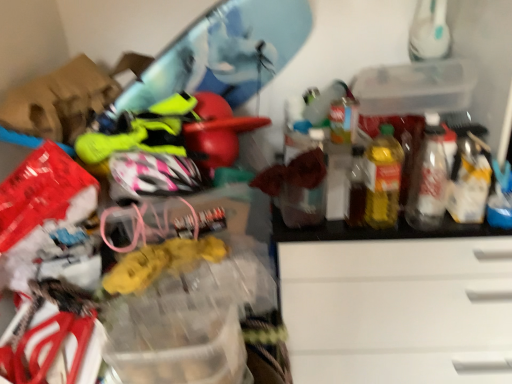
The height and width of the screenshot is (384, 512). What do you see at coordinates (383, 179) in the screenshot?
I see `yellow translucent bottle at right, which ranks as the 1th bottle in left-to-right order` at bounding box center [383, 179].

Looking at this image, what is the approximate width of yellow translucent bottle at right, which is the second bottle from right to left?

yellow translucent bottle at right, which is the second bottle from right to left, is 4.96 inches wide.

Where is `translucent plastic bottle at right, which is counted as the 1th bottle, starting from the right`? Image resolution: width=512 pixels, height=384 pixels. translucent plastic bottle at right, which is counted as the 1th bottle, starting from the right is located at coordinates (428, 182).

In order to face transparent plastic storage box at upper right, should I rotate leftwards or rightwards?

To face it directly, rotate right by 18.977 degrees.

Measure the distance between point (434, 84) and camera.

Point (434, 84) and camera are 4.58 feet apart.

The width and height of the screenshot is (512, 384). In order to click on yellow translucent bottle at right, which is the second bottle from right to left in this screenshot , I will do `click(383, 179)`.

From the image's perspective, who appears lower, transparent plastic storage box at upper right or yellow translucent bottle at right, which is the second bottle from right to left?

yellow translucent bottle at right, which is the second bottle from right to left, is shown below in the image.

How different are the orientations of transparent plastic storage box at upper right and yellow translucent bottle at right, which ranks as the 1th bottle in left-to-right order, in degrees?

2.23 degrees.

Considering the positions of objects transparent plastic storage box at upper right and yellow translucent bottle at right, which ranks as the 1th bottle in left-to-right order, in the image provided, who is more to the right, transparent plastic storage box at upper right or yellow translucent bottle at right, which ranks as the 1th bottle in left-to-right order,?

transparent plastic storage box at upper right is more to the right.

Is the depth of transparent plastic storage box at upper right less than that of yellow translucent bottle at right, which is the second bottle from right to left?

No.

Considering the relative sizes of yellow translucent bottle at right, which is the second bottle from right to left, and transparent plastic storage box at upper right in the image provided, is yellow translucent bottle at right, which is the second bottle from right to left, taller than transparent plastic storage box at upper right?

Yes, yellow translucent bottle at right, which is the second bottle from right to left, is taller than transparent plastic storage box at upper right.

Is yellow translucent bottle at right, which ranks as the 1th bottle in left-to-right order, further to camera compared to transparent plastic storage box at upper right?

No.

Does yellow translucent bottle at right, which is the second bottle from right to left, appear on the right side of transparent plastic storage box at upper right?

In fact, yellow translucent bottle at right, which is the second bottle from right to left, is to the left of transparent plastic storage box at upper right.

From a real-world perspective, is yellow translucent bottle at right, which ranks as the 1th bottle in left-to-right order, under transparent plastic storage box at upper right?

Indeed, from a real-world perspective, yellow translucent bottle at right, which ranks as the 1th bottle in left-to-right order, is positioned beneath transparent plastic storage box at upper right.

Who is more distant, translucent plastic bottle at right, which is counted as the 1th bottle, starting from the right, or yellow translucent bottle at right, which ranks as the 1th bottle in left-to-right order?

translucent plastic bottle at right, which is counted as the 1th bottle, starting from the right.

From the picture: Is translucent plastic bottle at right, positioned as the second bottle in left-to-right order, not near yellow translucent bottle at right, which ranks as the 1th bottle in left-to-right order?

No, translucent plastic bottle at right, positioned as the second bottle in left-to-right order, is not far from yellow translucent bottle at right, which ranks as the 1th bottle in left-to-right order.

Which is more to the left, translucent plastic bottle at right, positioned as the second bottle in left-to-right order, or yellow translucent bottle at right, which is the second bottle from right to left?

yellow translucent bottle at right, which is the second bottle from right to left.

The width and height of the screenshot is (512, 384). I want to click on bottle that is on the left side of translucent plastic bottle at right, positioned as the second bottle in left-to-right order, so click(x=383, y=179).

How different are the orientations of yellow translucent bottle at right, which is the second bottle from right to left, and translucent plastic bottle at right, which is counted as the 1th bottle, starting from the right, in degrees?

There is a 3.78-degree angle between the facing directions of yellow translucent bottle at right, which is the second bottle from right to left, and translucent plastic bottle at right, which is counted as the 1th bottle, starting from the right.

Who is more distant, yellow translucent bottle at right, which is the second bottle from right to left, or translucent plastic bottle at right, which is counted as the 1th bottle, starting from the right?

translucent plastic bottle at right, which is counted as the 1th bottle, starting from the right, is further from the camera.

In the scene shown: Is transparent plastic storage box at upper right taller than translucent plastic bottle at right, which is counted as the 1th bottle, starting from the right?

In fact, transparent plastic storage box at upper right may be shorter than translucent plastic bottle at right, which is counted as the 1th bottle, starting from the right.

Between transparent plastic storage box at upper right and translucent plastic bottle at right, which is counted as the 1th bottle, starting from the right, which one appears on the left side from the viewer's perspective?

From the viewer's perspective, transparent plastic storage box at upper right appears more on the left side.

Is transparent plastic storage box at upper right bigger or smaller than translucent plastic bottle at right, positioned as the second bottle in left-to-right order?

In the image, transparent plastic storage box at upper right appears to be larger than translucent plastic bottle at right, positioned as the second bottle in left-to-right order.

From the image's perspective, is transparent plastic storage box at upper right located above or below translucent plastic bottle at right, positioned as the second bottle in left-to-right order?

transparent plastic storage box at upper right is situated higher than translucent plastic bottle at right, positioned as the second bottle in left-to-right order, in the image.

From a real-world perspective, which is physically below, translucent plastic bottle at right, which is counted as the 1th bottle, starting from the right, or transparent plastic storage box at upper right?

translucent plastic bottle at right, which is counted as the 1th bottle, starting from the right, from a real-world perspective.

Does translucent plastic bottle at right, which is counted as the 1th bottle, starting from the right, come in front of transparent plastic storage box at upper right?

Yes, it is.

Considering the sizes of objects translucent plastic bottle at right, positioned as the second bottle in left-to-right order, and transparent plastic storage box at upper right in the image provided, who is thinner, translucent plastic bottle at right, positioned as the second bottle in left-to-right order, or transparent plastic storage box at upper right?

translucent plastic bottle at right, positioned as the second bottle in left-to-right order, is thinner.

Find the location of a particular element. This screenshot has height=384, width=512. bottle that is the 2nd object located below the transparent plastic storage box at upper right (from the image's perspective) is located at coordinates (383, 179).

Where is `storage box behind the yellow translucent bottle at right, which ranks as the 1th bottle in left-to-right order`? This screenshot has height=384, width=512. storage box behind the yellow translucent bottle at right, which ranks as the 1th bottle in left-to-right order is located at coordinates (415, 88).

Considering their positions, is transparent plastic storage box at upper right positioned closer to translucent plastic bottle at right, which is counted as the 1th bottle, starting from the right, than yellow translucent bottle at right, which ranks as the 1th bottle in left-to-right order?

Among the two, yellow translucent bottle at right, which ranks as the 1th bottle in left-to-right order, is located nearer to translucent plastic bottle at right, which is counted as the 1th bottle, starting from the right.

Looking at this image, considering their positions, is yellow translucent bottle at right, which ranks as the 1th bottle in left-to-right order, positioned further to translucent plastic bottle at right, positioned as the second bottle in left-to-right order, than transparent plastic storage box at upper right?

transparent plastic storage box at upper right.

Considering their positions, is translucent plastic bottle at right, which is counted as the 1th bottle, starting from the right, positioned closer to transparent plastic storage box at upper right than yellow translucent bottle at right, which ranks as the 1th bottle in left-to-right order?

The object closer to transparent plastic storage box at upper right is yellow translucent bottle at right, which ranks as the 1th bottle in left-to-right order.

Considering their positions, is transparent plastic storage box at upper right positioned further to yellow translucent bottle at right, which is the second bottle from right to left, than translucent plastic bottle at right, which is counted as the 1th bottle, starting from the right?

The object further to yellow translucent bottle at right, which is the second bottle from right to left, is transparent plastic storage box at upper right.

From the image, which object appears to be farther from transparent plastic storage box at upper right, yellow translucent bottle at right, which is the second bottle from right to left, or translucent plastic bottle at right, positioned as the second bottle in left-to-right order?

The object further to transparent plastic storage box at upper right is translucent plastic bottle at right, positioned as the second bottle in left-to-right order.

When comparing their distances from yellow translucent bottle at right, which is the second bottle from right to left, does translucent plastic bottle at right, positioned as the second bottle in left-to-right order, or transparent plastic storage box at upper right seem further?

The object further to yellow translucent bottle at right, which is the second bottle from right to left, is transparent plastic storage box at upper right.

What are the coordinates of `bottle between transparent plastic storage box at upper right and yellow translucent bottle at right, which ranks as the 1th bottle in left-to-right order, vertically` in the screenshot? It's located at (428, 182).